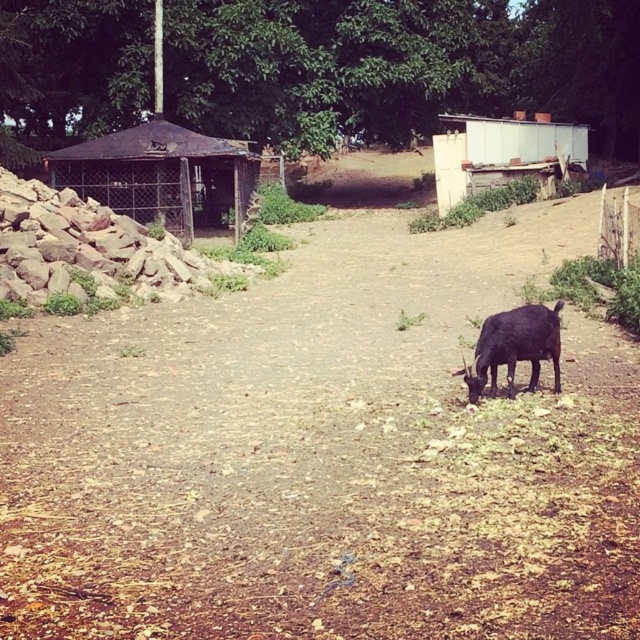
Question: Does rusty metal hut at left appear over black matte goat at lower right?

Choices:
 (A) no
 (B) yes

Answer: (B)

Question: Estimate the real-world distances between objects in this image. Which object is farther from the black matte goat at lower right?

Choices:
 (A) white corrugated metal hut at upper right
 (B) brown dirt track at center

Answer: (A)

Question: Which point appears farthest from the camera in this image?

Choices:
 (A) (163, 179)
 (B) (600, 605)

Answer: (A)

Question: Can you confirm if brown dirt track at center is positioned above black matte goat at lower right?

Choices:
 (A) yes
 (B) no

Answer: (B)

Question: Does rusty metal hut at left come in front of black matte goat at lower right?

Choices:
 (A) yes
 (B) no

Answer: (B)

Question: Which point is closer to the camera?

Choices:
 (A) brown dirt track at center
 (B) white corrugated metal hut at upper right
 (C) black matte goat at lower right
 (D) rusty metal hut at left

Answer: (A)